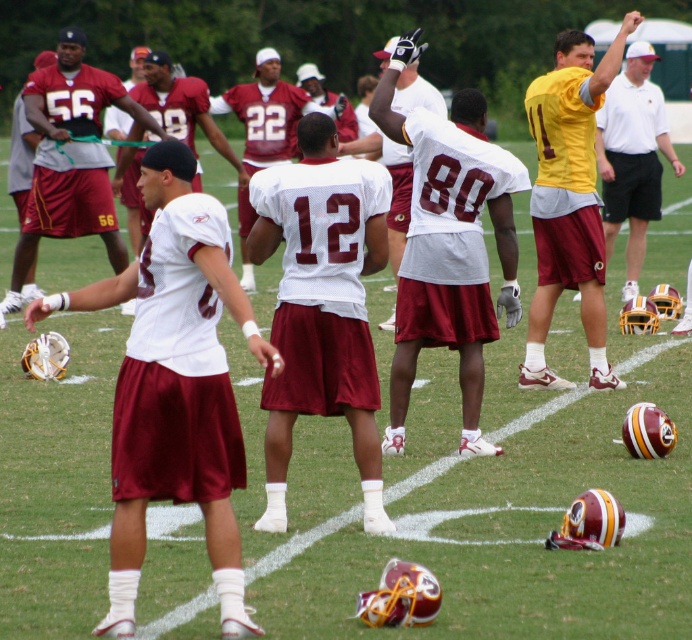
Question: Which point is closer to the camera?

Choices:
 (A) yellow jersey at center
 (B) maroon satin jersey at center

Answer: (B)

Question: Which point is closer to the camera?

Choices:
 (A) (75, 208)
 (B) (579, 184)

Answer: (B)

Question: Which point is closer to the camera?

Choices:
 (A) (619, 102)
 (B) (273, 390)

Answer: (B)

Question: Can you confirm if white matte jersey at center is positioned to the right of maroon satin jersey at center?

Choices:
 (A) yes
 (B) no

Answer: (A)

Question: Where is yellow jersey at upper right located in relation to maroon jersey at center in the image?

Choices:
 (A) below
 (B) above

Answer: (A)

Question: Can you confirm if yellow jersey at upper right is positioned below maroon satin jersey at center?

Choices:
 (A) no
 (B) yes

Answer: (A)